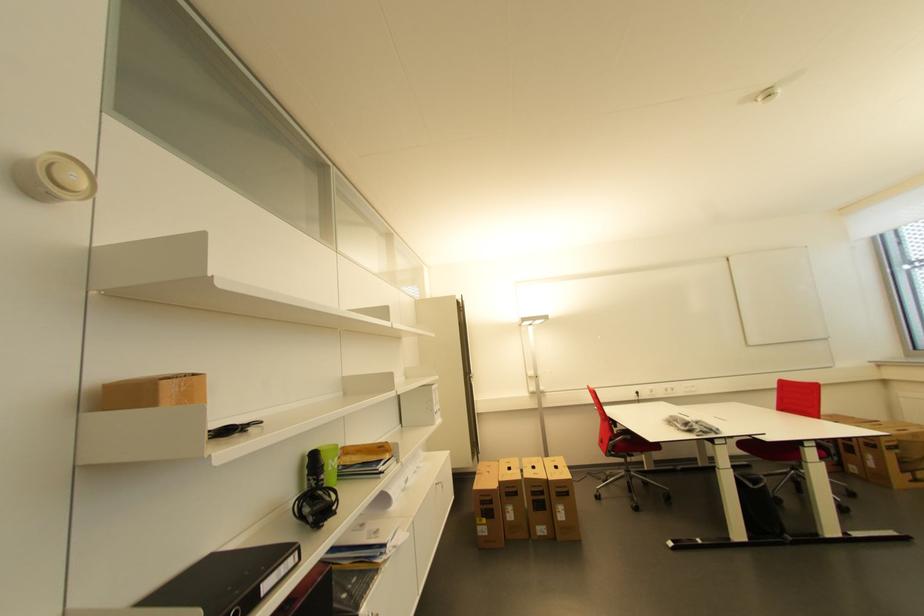
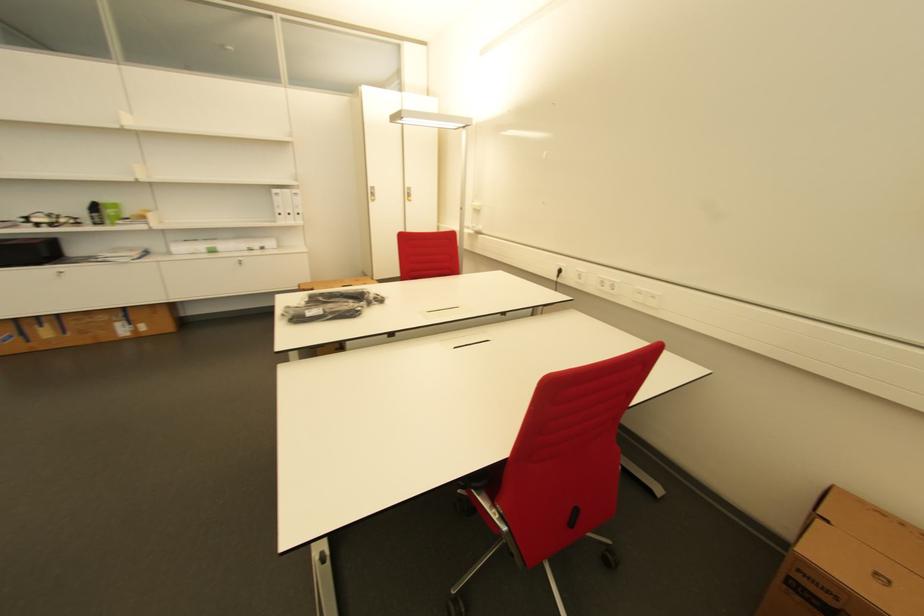
Find the pixel in the second image that matches point 699,387 in the first image.

(659, 299)